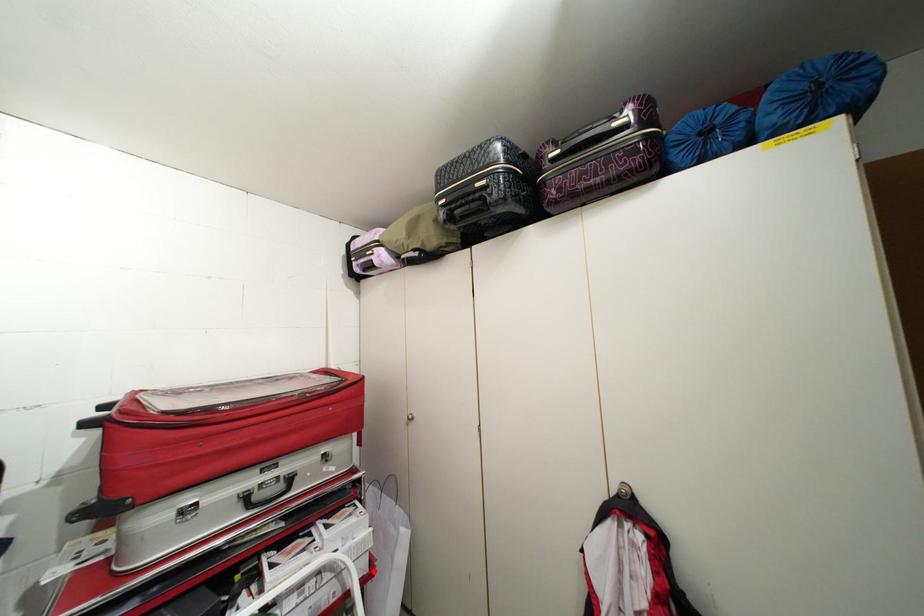
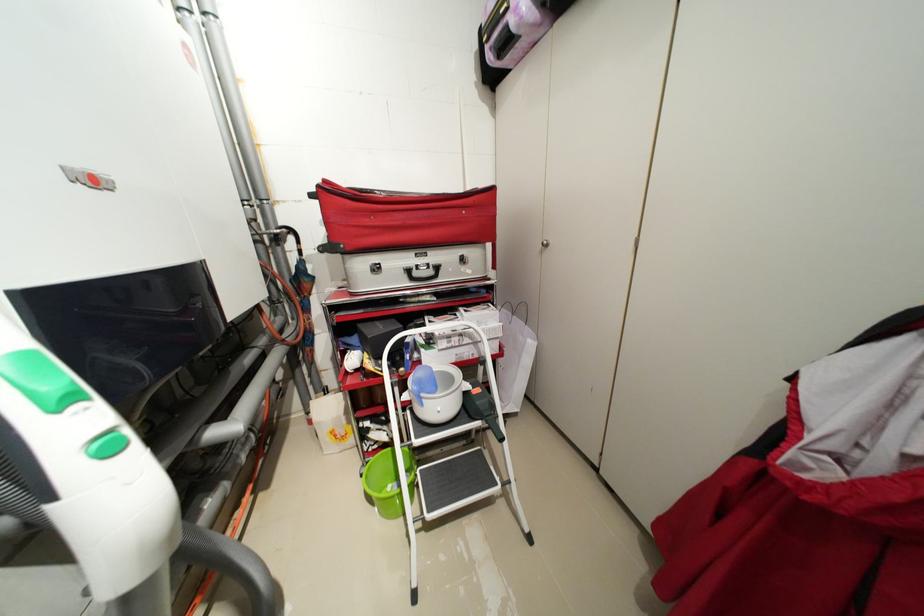
In the second image, find the point that corresponds to the highlighted location in the first image.

(505, 352)